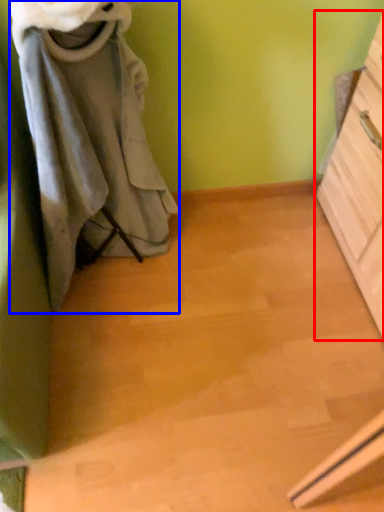
Question: Which object is closer to the camera taking this photo, chest of drawers (highlighted by a red box) or laundry (highlighted by a blue box)?

Choices:
 (A) chest of drawers
 (B) laundry

Answer: (B)